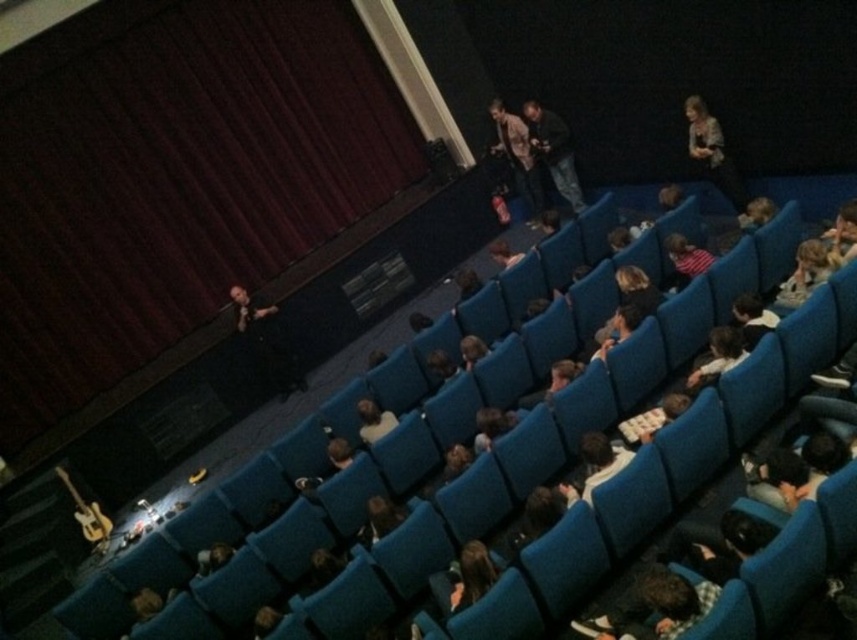
Question: Does light brown hair at upper right lie behind dark brown hair at lower center?

Choices:
 (A) yes
 (B) no

Answer: (A)

Question: Considering the real-world distances, which object is closest to the light brown hair at upper right?

Choices:
 (A) dark red velvet curtain at upper left
 (B) light brown leather jacket at upper center

Answer: (B)

Question: Estimate the real-world distances between objects in this image. Which object is closer to the light brown hair at upper right?

Choices:
 (A) dark red velvet curtain at upper left
 (B) patterned fabric jacket at upper right

Answer: (B)

Question: Estimate the real-world distances between objects in this image. Which object is closer to the light brown leather jacket at upper center?

Choices:
 (A) dark blue jeans at center
 (B) striped fabric shirt at right
 (C) dark brown hair at lower center
 (D) dark red velvet curtain at upper left

Answer: (A)

Question: Considering the relative positions of light brown hair at upper right and striped fabric shirt at right in the image provided, where is light brown hair at upper right located with respect to striped fabric shirt at right?

Choices:
 (A) right
 (B) left

Answer: (A)

Question: Is dark red velvet curtain at upper left to the right of striped fabric shirt at right from the viewer's perspective?

Choices:
 (A) yes
 (B) no

Answer: (B)